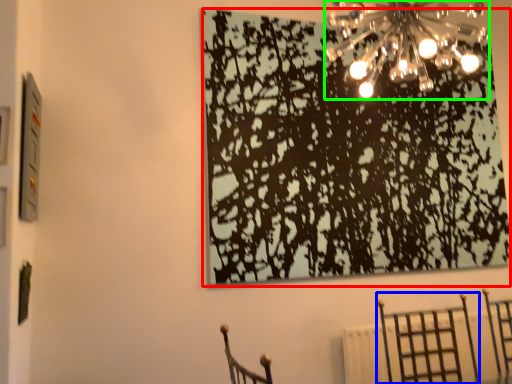
Question: Based on their relative distances, which object is farther from tree (highlighted by a red box)? Choose from furniture (highlighted by a blue box) and lamp (highlighted by a green box).

Choices:
 (A) furniture
 (B) lamp

Answer: (A)